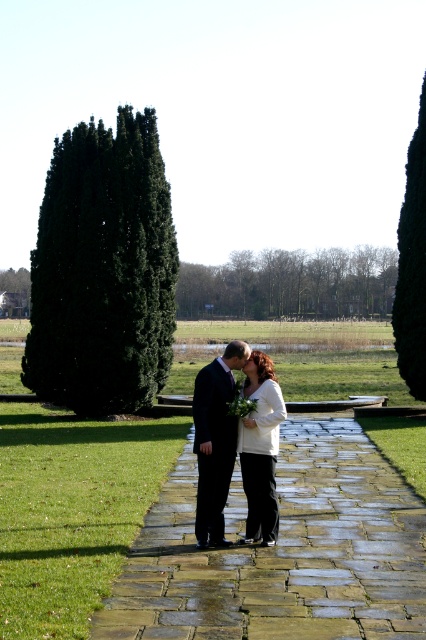
You are a photographer trying to capture the couple standing on the cobblestone path. To ensure the green leafy tree at center is in the background, where should you position yourself relative to the couple?

Position yourself so that the green leafy tree at center is behind the couple, as its 2D coordinates at point (290, 284) place it centrally in the frame, making it a natural backdrop for the couple.

You are a photographer setting up for a couple photo shoot. You want to position the couple so that the stone paved walkway at center is between them and the dark green coniferous tree at left. Is this possible given their current positions?

The stone paved walkway at center is to the right of the dark green coniferous tree at left. Therefore, placing the couple so that the walkway is between them and the tree would require them to be positioned to the right of the walkway, but since the walkway is already to the right of the tree, this arrangement isn